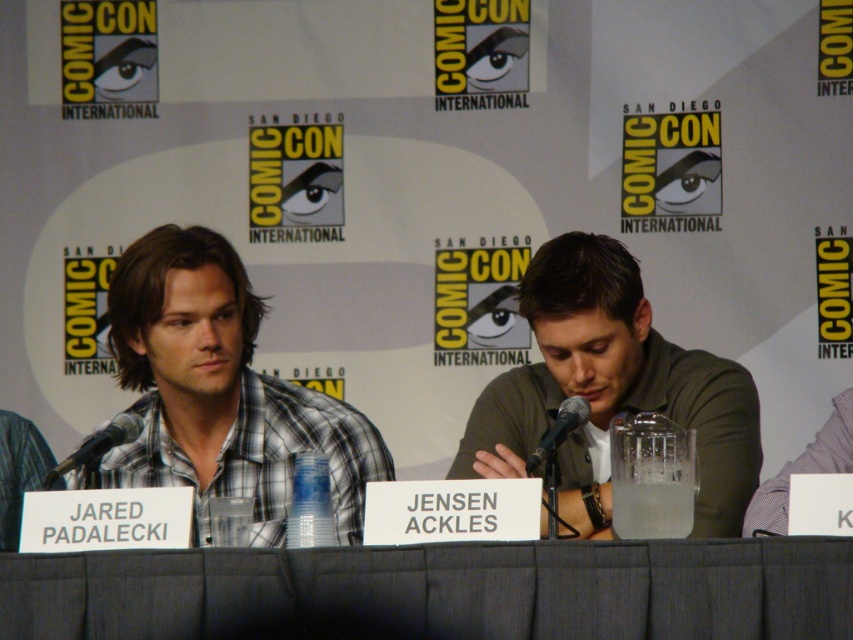
Question: Based on their relative distances, which object is nearer to the black metallic microphone at left?

Choices:
 (A) plaid shirt at left
 (B) gray fabric table at center
 (C) black metallic microphone at center
 (D) green matte shirt at center

Answer: (A)

Question: Does gray fabric table at center appear over green matte shirt at center?

Choices:
 (A) yes
 (B) no

Answer: (B)

Question: Which object appears closest to the camera in this image?

Choices:
 (A) plaid shirt at left
 (B) black metallic microphone at center
 (C) green matte shirt at center

Answer: (A)

Question: Can you confirm if green matte shirt at center is bigger than black metallic microphone at left?

Choices:
 (A) yes
 (B) no

Answer: (A)

Question: Which point appears closest to the camera in this image?

Choices:
 (A) (64, 611)
 (B) (567, 422)
 (C) (200, 305)
 (D) (670, 406)

Answer: (A)

Question: Is gray fabric table at center above green matte shirt at center?

Choices:
 (A) no
 (B) yes

Answer: (A)